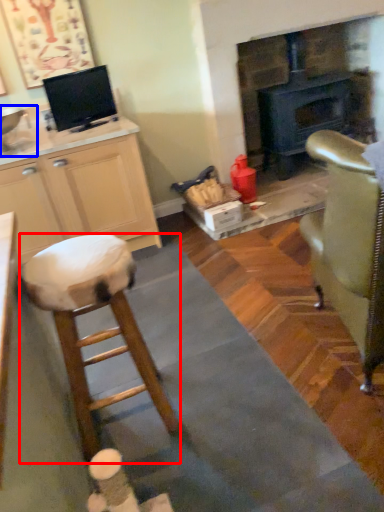
Question: Which point is closer to the camera, stool (highlighted by a red box) or sink (highlighted by a blue box)?

Choices:
 (A) stool
 (B) sink

Answer: (A)